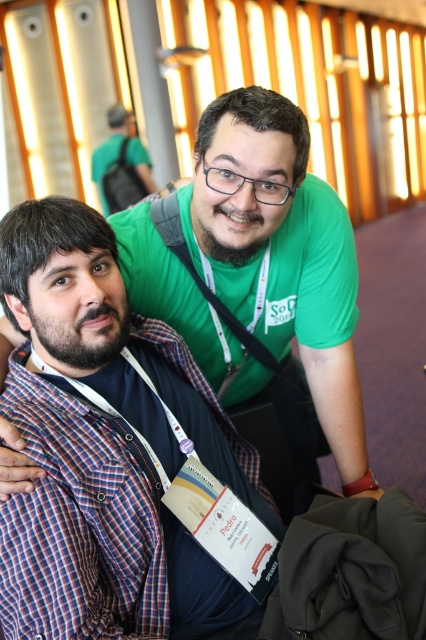
You are organizing a photo shoot and need to place two shirts on a mannequin. The plaid cotton shirt at left and the matte green shirt at upper center are available. Which shirt should you choose if you want the one that is narrower?

The plaid cotton shirt at left has a lesser width compared to the matte green shirt at upper center, so you should choose the plaid cotton shirt at left for a narrower option.

Looking at this image, you are at a conference and need to find Pedro. You see a green matte shirt at upper center and a plaid cotton shirt at left. Which one is more to the left?

The plaid cotton shirt at left is more to the left since the green matte shirt at upper center is positioned on its right side.

You are at a conference and need to approach the speaker. The speaker is wearing the plaid cotton shirt at left. There is someone in front of them wearing the green matte shirt at upper center. Can you walk directly to the speaker without going around?

The plaid cotton shirt at left is behind the green matte shirt at upper center, so you cannot walk directly to the speaker without moving around the person in front.